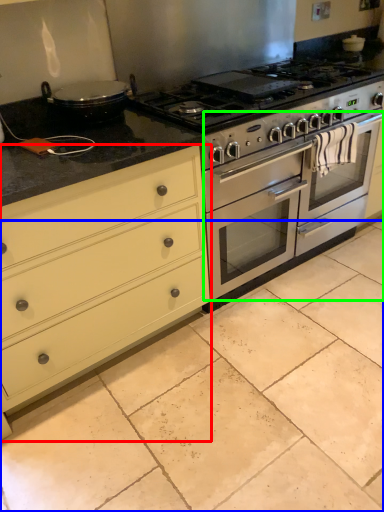
Question: Which object is the farthest from chest of drawers (highlighted by a red box)? Choose among these: ceramic tile (highlighted by a blue box) or oven (highlighted by a green box).

Choices:
 (A) ceramic tile
 (B) oven

Answer: (B)